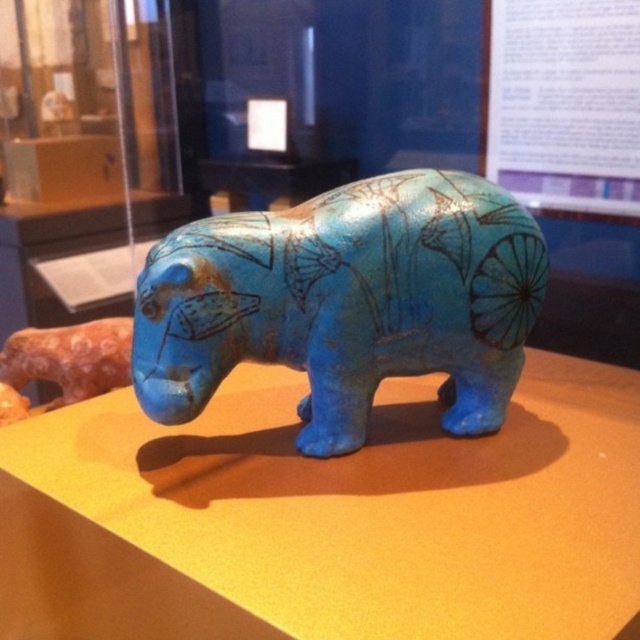
Question: Observing the image, what is the correct spatial positioning of matte blue hippo at center in reference to blue glossy elephant at center?

Choices:
 (A) below
 (B) above

Answer: (A)

Question: Among these objects, which one is farthest from the camera?

Choices:
 (A) matte blue hippo at center
 (B) blue glossy elephant at center

Answer: (B)

Question: Observing the image, what is the correct spatial positioning of matte blue hippo at center in reference to blue glossy elephant at center?

Choices:
 (A) left
 (B) right

Answer: (A)

Question: Is matte blue hippo at center positioned at the back of blue glossy elephant at center?

Choices:
 (A) yes
 (B) no

Answer: (B)